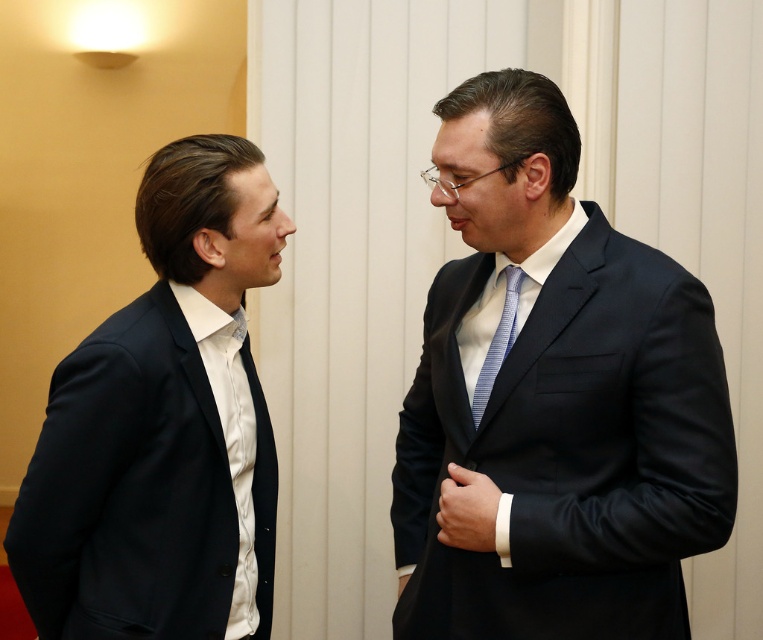
You are standing in front of the two men in the image. Which of the two points, point (567, 275) or point (124, 504), is closer to you?

Point (124, 504) is closer to you because it is positioned closer to the camera than point (567, 275).